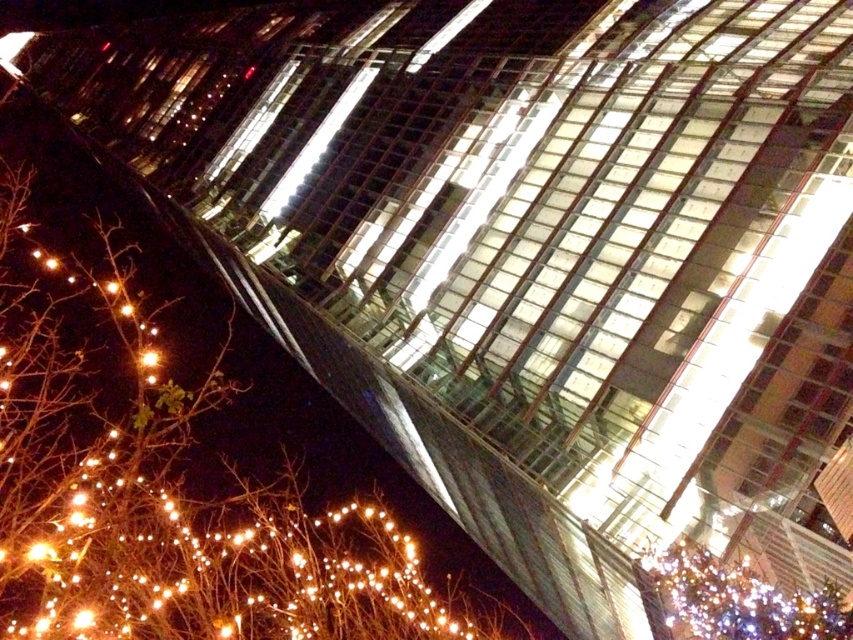
Is shiny gold lights at lower left closer to the viewer compared to illuminated glass tree at lower right?

That is False.

Does shiny gold lights at lower left have a greater height compared to illuminated glass tree at lower right?

Yes, shiny gold lights at lower left is taller than illuminated glass tree at lower right.

Describe the element at coordinates (170, 490) in the screenshot. I see `shiny gold lights at lower left` at that location.

You are a GUI agent. You are given a task and a screenshot of the screen. Output one action in this format:
    pyautogui.click(x=<x>, y=<y>)
    Task: Click on the shiny gold lights at lower left
    Image resolution: width=853 pixels, height=640 pixels.
    Given the screenshot: What is the action you would take?
    pyautogui.click(x=170, y=490)